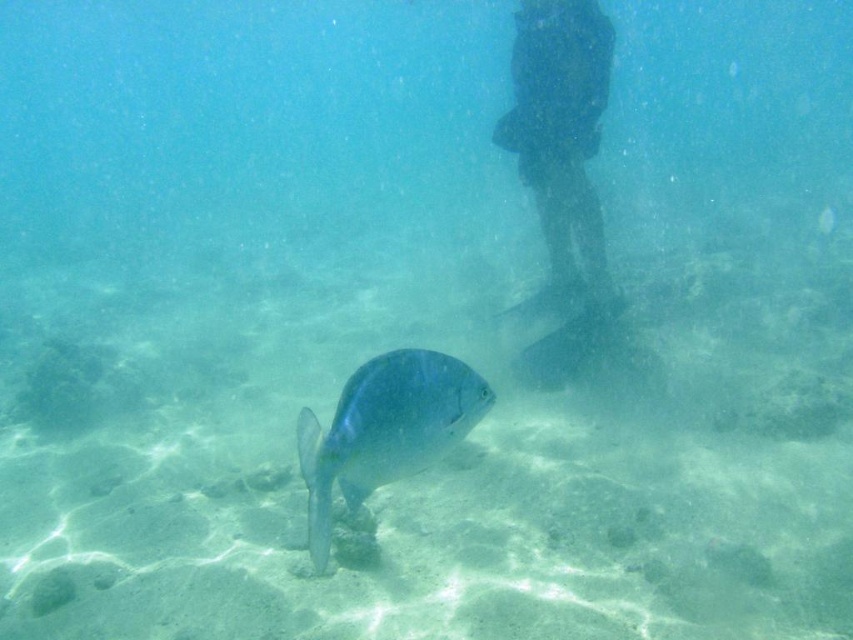
You are a scuba diver who wants to avoid stepping on the shiny blue fish at center. Given that you are standing on the dark blue rubber boots at upper center, which are above the fish, can you safely move your feet without touching the fish?

The dark blue rubber boots at upper center are positioned over the shiny blue fish at center, so you can move your feet carefully as the boots are already above the fish and not directly on top of it.

You are a scuba diver who just noticed the dark blue rubber boots at upper center and the shiny blue fish at center in the water. Which object is bigger in size?

The dark blue rubber boots at upper center is larger in size than the shiny blue fish at center.

You are a diver who wants to avoid stepping on the shiny blue fish at center. The dark blue rubber boots at upper center are currently above it. Can you tell me if the boots are wide enough to step over the fish without touching it?

The dark blue rubber boots at upper center might be wider than the shiny blue fish at center, so stepping over the fish might be possible without touching it if the boots are indeed wider.